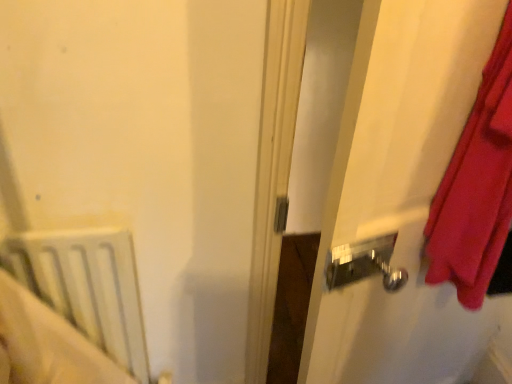
What do you see at coordinates (88, 286) in the screenshot? The height and width of the screenshot is (384, 512). I see `white matte radiator at lower left` at bounding box center [88, 286].

Find the location of a particular element. This screenshot has height=384, width=512. white matte radiator at lower left is located at coordinates (88, 286).

The height and width of the screenshot is (384, 512). I want to click on white glossy door handle at right, so (399, 197).

This screenshot has width=512, height=384. Describe the element at coordinates (399, 197) in the screenshot. I see `white glossy door handle at right` at that location.

Measure the distance between point (451, 294) and camera.

Point (451, 294) and camera are 3.45 feet apart from each other.

This screenshot has width=512, height=384. In order to click on white matte radiator at lower left in this screenshot , I will do `click(88, 286)`.

Which object is positioned more to the left, white matte radiator at lower left or white glossy door handle at right?

white matte radiator at lower left is more to the left.

Which is in front, white matte radiator at lower left or white glossy door handle at right?

white glossy door handle at right is in front.

Is point (123, 239) positioned before point (461, 46)?

No.

From the image's perspective, is white matte radiator at lower left on top of white glossy door handle at right?

No, from the image's perspective, white matte radiator at lower left is not above white glossy door handle at right.

From a real-world perspective, between white matte radiator at lower left and white glossy door handle at right, who is vertically lower?

white matte radiator at lower left, from a real-world perspective.

Can you confirm if white matte radiator at lower left is wider than white glossy door handle at right?

In fact, white matte radiator at lower left might be narrower than white glossy door handle at right.

Does white matte radiator at lower left have a lesser height compared to white glossy door handle at right?

Correct, white matte radiator at lower left is not as tall as white glossy door handle at right.

Is white matte radiator at lower left bigger or smaller than white glossy door handle at right?

Clearly, white matte radiator at lower left is smaller in size than white glossy door handle at right.

Is white matte radiator at lower left spatially inside white glossy door handle at right, or outside of it?

white matte radiator at lower left lies outside white glossy door handle at right.

Is white matte radiator at lower left with white glossy door handle at right?

No, white matte radiator at lower left is not in contact with white glossy door handle at right.

Is white matte radiator at lower left facing away from white glossy door handle at right?

No, white glossy door handle at right is not at the back of white matte radiator at lower left.

Consider the image. What's the angular difference between white matte radiator at lower left and white glossy door handle at right's facing directions?

There is a 26.8-degree angle between the facing directions of white matte radiator at lower left and white glossy door handle at right.

Measure the distance between white matte radiator at lower left and white glossy door handle at right.

A distance of 22.36 inches exists between white matte radiator at lower left and white glossy door handle at right.

Locate an element on the screen. radiator on the left of white glossy door handle at right is located at coordinates (88, 286).

Visually, is white glossy door handle at right positioned to the left or to the right of white matte radiator at lower left?

white glossy door handle at right is positioned on white matte radiator at lower left's right side.

Is white glossy door handle at right further to the viewer compared to white matte radiator at lower left?

That is False.

Considering the positions of points (347, 198) and (131, 277), is point (347, 198) closer to camera compared to point (131, 277)?

Yes.

From the image's perspective, which one is positioned higher, white glossy door handle at right or white matte radiator at lower left?

white glossy door handle at right appears higher in the image.

From a real-world perspective, is white glossy door handle at right physically above white matte radiator at lower left?

Yes, from a real-world perspective, white glossy door handle at right is on top of white matte radiator at lower left.

Which object is wider, white glossy door handle at right or white matte radiator at lower left?

Wider between the two is white glossy door handle at right.

Does white glossy door handle at right have a lesser height compared to white matte radiator at lower left?

In fact, white glossy door handle at right may be taller than white matte radiator at lower left.

In the scene shown: Considering the sizes of white glossy door handle at right and white matte radiator at lower left in the image, is white glossy door handle at right bigger or smaller than white matte radiator at lower left?

white glossy door handle at right is bigger than white matte radiator at lower left.

Is white matte radiator at lower left surrounded by white glossy door handle at right?

No, white matte radiator at lower left is not inside white glossy door handle at right.

Is white glossy door handle at right not close to white matte radiator at lower left?

Actually, white glossy door handle at right and white matte radiator at lower left are a little close together.

Does white glossy door handle at right turn towards white matte radiator at lower left?

No, white glossy door handle at right is not turned towards white matte radiator at lower left.

You are a GUI agent. You are given a task and a screenshot of the screen. Output one action in this format:
    pyautogui.click(x=<x>, y=<y>)
    Task: Click on the radiator below the white glossy door handle at right (from the image's perspective)
    The image size is (512, 384).
    Given the screenshot: What is the action you would take?
    pyautogui.click(x=88, y=286)

Where is `screen door to the right of white matte radiator at lower left`? Image resolution: width=512 pixels, height=384 pixels. screen door to the right of white matte radiator at lower left is located at coordinates (399, 197).

In the image, there is a white glossy door handle at right. Identify the location of radiator below it (from the image's perspective). Image resolution: width=512 pixels, height=384 pixels. (88, 286).